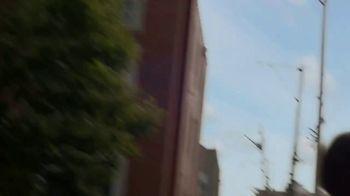
The image size is (350, 196). In order to click on window in this screenshot , I will do `click(190, 83)`, `click(199, 84)`, `click(189, 124)`, `click(196, 128)`, `click(203, 179)`, `click(201, 191)`.